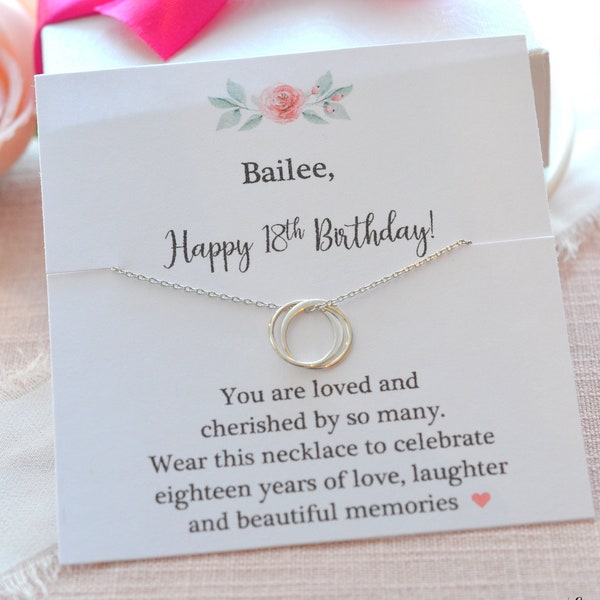
The image size is (600, 600). I want to click on light in right corner, so pyautogui.click(x=585, y=70).